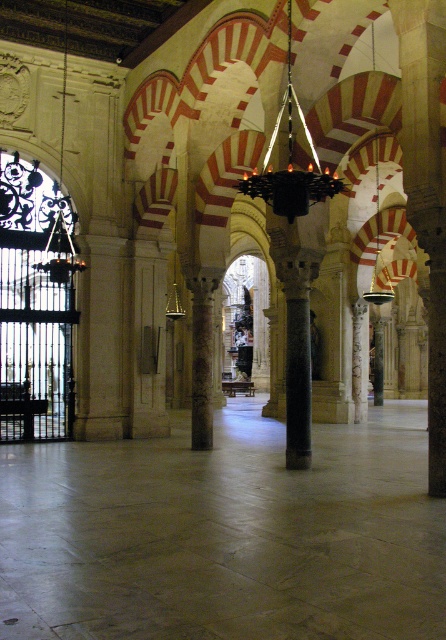
Which is more to the left, black matte chandelier at center or brown textured column at center?

brown textured column at center

Which is behind, point (298, 198) or point (193, 420)?

Positioned behind is point (193, 420).

This screenshot has height=640, width=446. What are the coordinates of `black matte chandelier at center` in the screenshot? It's located at (290, 163).